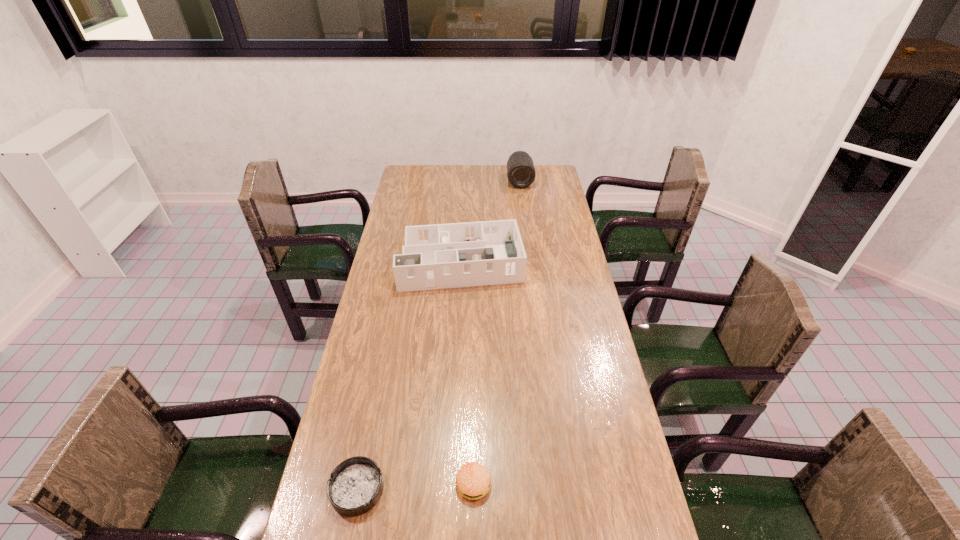
Where is `vacant area that lies between the shortest object and the telephoto lens`? The width and height of the screenshot is (960, 540). vacant area that lies between the shortest object and the telephoto lens is located at coordinates (439, 335).

What are the coordinates of `free point between the shortest object and the third tallest object` in the screenshot? It's located at (415, 486).

Image resolution: width=960 pixels, height=540 pixels. Find the location of `free space between the dollhouse and the telephoto lens`. free space between the dollhouse and the telephoto lens is located at coordinates (491, 221).

This screenshot has height=540, width=960. In order to click on vacant space that's between the farthest object and the third tallest object in this screenshot , I will do `click(496, 332)`.

Identify the location of empty location between the ashtray and the third nearest object. Image resolution: width=960 pixels, height=540 pixels. (409, 375).

In order to click on free space between the telephoto lens and the shortest object in this screenshot , I will do `click(439, 335)`.

Locate an element on the screen. The height and width of the screenshot is (540, 960). empty space that is in between the third tallest object and the second farthest object is located at coordinates (468, 372).

Locate an element on the screen. This screenshot has height=540, width=960. object that is the second closest to the telephoto lens is located at coordinates (473, 481).

The height and width of the screenshot is (540, 960). Identify the location of object that ranks as the third closest to the dollhouse. (473, 481).

Image resolution: width=960 pixels, height=540 pixels. Find the location of `free spot that satisfies the following two spatial constraints: 1. on the back side of the patty; 2. on the right side of the shortest object`. free spot that satisfies the following two spatial constraints: 1. on the back side of the patty; 2. on the right side of the shortest object is located at coordinates (358, 483).